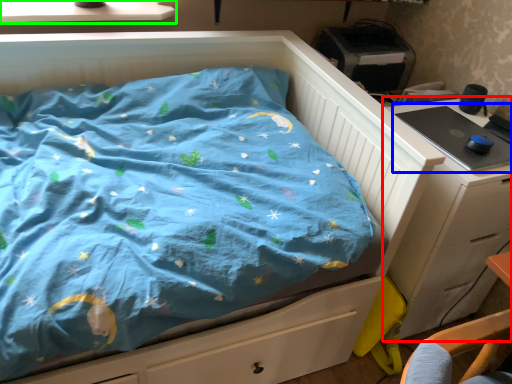
Question: Estimate the real-world distances between objects in this image. Which object is farther from chest of drawers (highlighted by a red box), desktop (highlighted by a blue box) or window sill (highlighted by a green box)?

Choices:
 (A) desktop
 (B) window sill

Answer: (B)